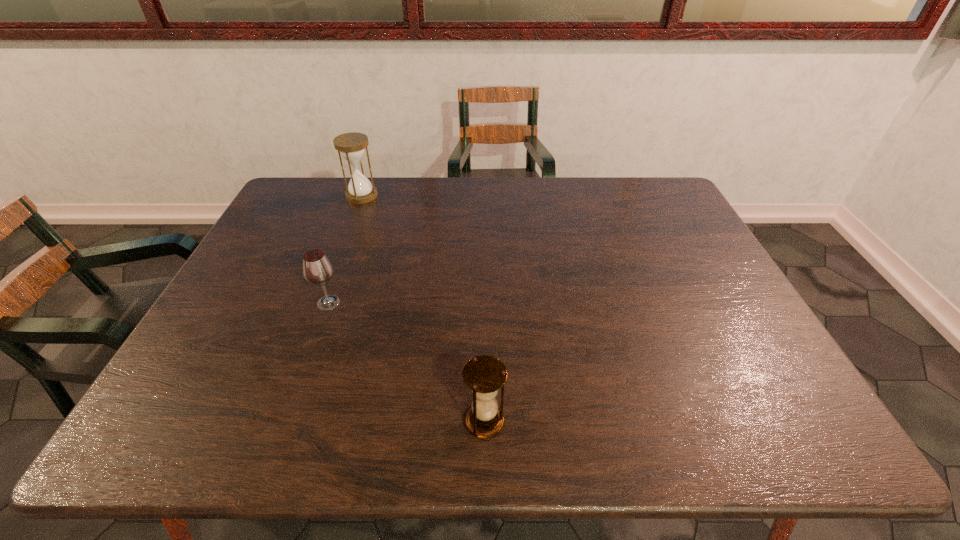
The image size is (960, 540). What are the coordinates of `empty location between the farthest object and the wineglass` in the screenshot? It's located at (346, 249).

The height and width of the screenshot is (540, 960). I want to click on free space between the second nearest object and the farthest object, so click(346, 249).

Find the location of a particular element. The height and width of the screenshot is (540, 960). vacant area between the wineglass and the taller hourglass is located at coordinates (346, 249).

At what (x,y) coordinates should I click in order to perform the action: click on vacant space that's between the taller hourglass and the wineglass. Please return your answer as a coordinate pair (x, y). This screenshot has width=960, height=540. Looking at the image, I should click on (346, 249).

Find the location of `empty location between the nearest object and the left hourglass`. empty location between the nearest object and the left hourglass is located at coordinates (423, 308).

Point out which object is positioned as the second nearest to the left hourglass. Please provide its 2D coordinates. Your answer should be formatted as a tuple, i.e. [(x, y)], where the tuple contains the x and y coordinates of a point satisfying the conditions above.

[(484, 375)]

What are the coordinates of `object that is the second closest to the farthest object` in the screenshot? It's located at (484, 375).

Find the location of `vacant position in the image that satisfies the following two spatial constraints: 1. on the front side of the wineglass; 2. on the left side of the farthest object`. vacant position in the image that satisfies the following two spatial constraints: 1. on the front side of the wineglass; 2. on the left side of the farthest object is located at coordinates (322, 303).

The height and width of the screenshot is (540, 960). Identify the location of vacant area that satisfies the following two spatial constraints: 1. on the front side of the second farthest object; 2. on the right side of the right hourglass. (286, 421).

Find the location of a particular element. The width and height of the screenshot is (960, 540). vacant space that satisfies the following two spatial constraints: 1. on the front side of the right hourglass; 2. on the right side of the farther hourglass is located at coordinates (277, 421).